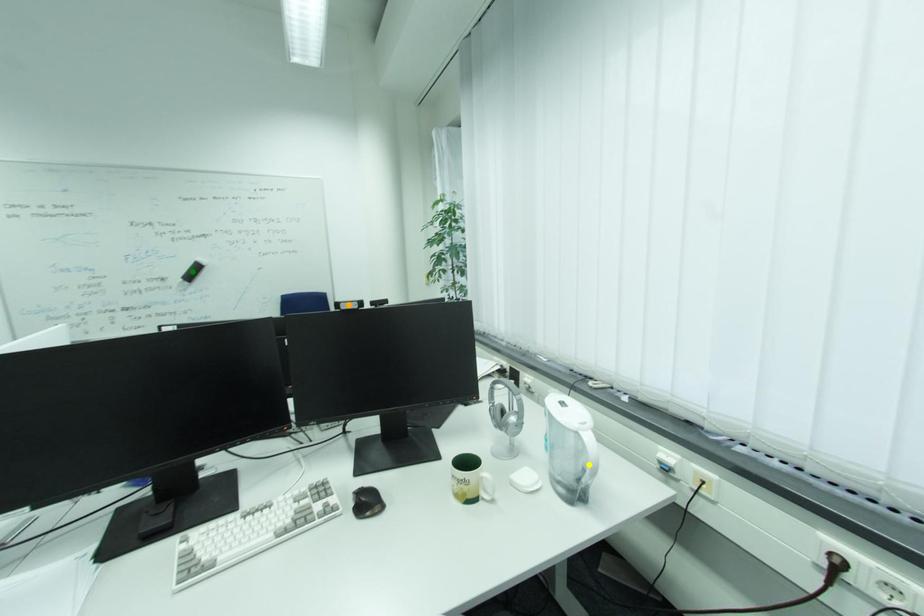
Order these from nearest to farthest:
yellow point
orange point
green point

yellow point → orange point → green point